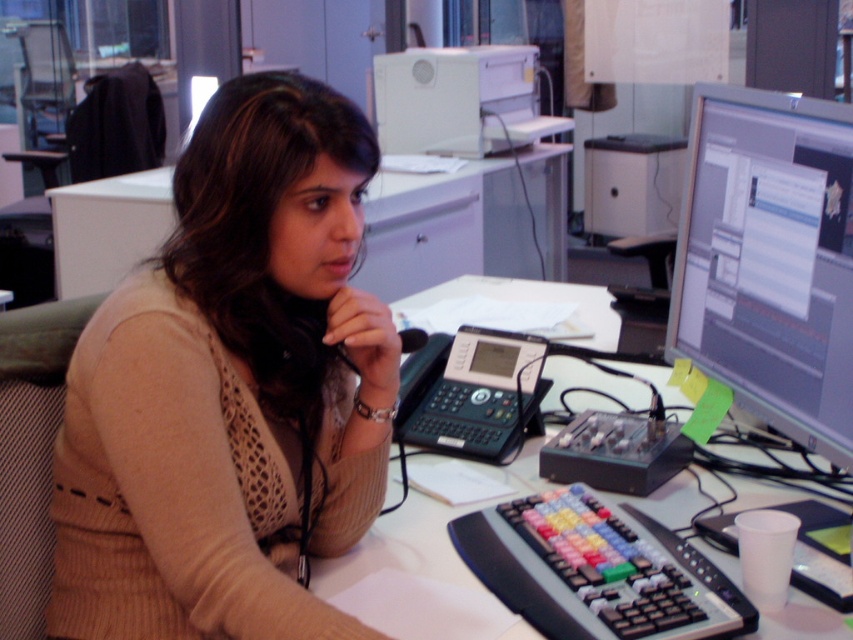
Is beige knitted sweater at center smaller than black plastic telephone at center?

No, beige knitted sweater at center is not smaller than black plastic telephone at center.

Image resolution: width=853 pixels, height=640 pixels. What do you see at coordinates (230, 388) in the screenshot?
I see `beige knitted sweater at center` at bounding box center [230, 388].

You are a GUI agent. You are given a task and a screenshot of the screen. Output one action in this format:
    pyautogui.click(x=<x>, y=<y>)
    Task: Click on the beige knitted sweater at center
    
    Given the screenshot: What is the action you would take?
    pyautogui.click(x=230, y=388)

In the scene shown: Can you confirm if white glossy table at upper center is positioned below white plastic table at center?

Incorrect, white glossy table at upper center is not positioned below white plastic table at center.

Which of these two, white glossy table at upper center or white plastic table at center, stands shorter?

white plastic table at center

Where is `white glossy table at upper center`? white glossy table at upper center is located at coordinates (445, 228).

Which is more to the right, matte gray monitor at right or black plastic telephone at center?

matte gray monitor at right is more to the right.

Which is in front, point (813, 140) or point (468, 440)?

Point (813, 140)

Which is behind, point (718, 356) or point (535, 385)?

The point (535, 385) is behind.

Where is `matte gray monitor at right`? The height and width of the screenshot is (640, 853). matte gray monitor at right is located at coordinates (769, 259).